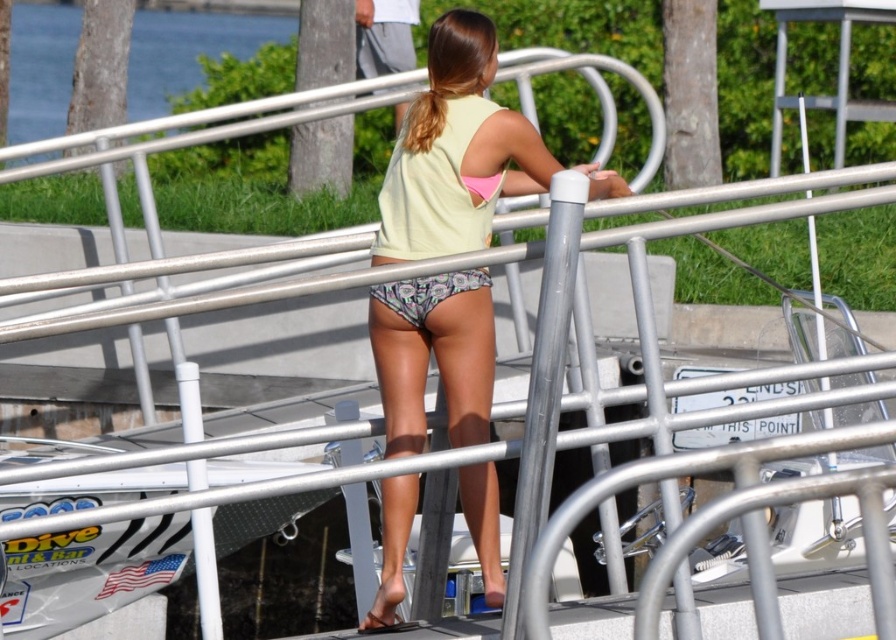
Does matte yellow tank top at center lie behind printed fabric bikini bottom at center?

That is False.

Does matte yellow tank top at center appear on the left side of printed fabric bikini bottom at center?

In fact, matte yellow tank top at center is to the right of printed fabric bikini bottom at center.

Who is more distant from viewer, (438, 241) or (414, 307)?

The point (414, 307) is more distant.

Where is `matte yellow tank top at center`? Image resolution: width=896 pixels, height=640 pixels. matte yellow tank top at center is located at coordinates (455, 150).

Between matte yellow tank top at center and light yellow fabric bikini top at center, which one is positioned lower?

matte yellow tank top at center is below.

Based on the photo, how far apart are matte yellow tank top at center and light yellow fabric bikini top at center?

15.56 inches

Locate an element on the screen. The height and width of the screenshot is (640, 896). matte yellow tank top at center is located at coordinates (455, 150).

Between point (467, 241) and point (368, 42), which one is positioned behind?

Positioned behind is point (368, 42).

Does point (481, 218) come closer to viewer compared to point (381, 52)?

Yes, point (481, 218) is in front of point (381, 52).

Find the location of `light yellow fabric bikini top at center`. light yellow fabric bikini top at center is located at coordinates (435, 192).